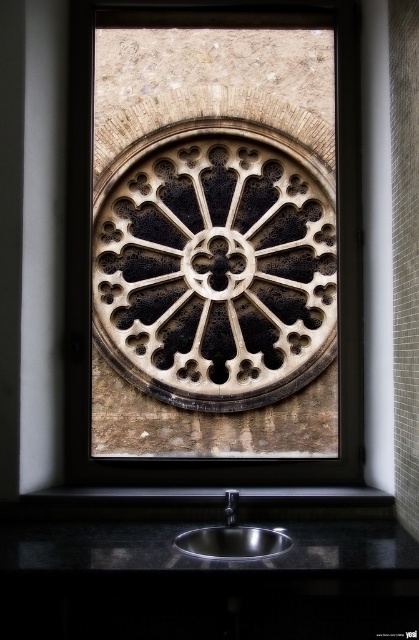
Question: Which of the following is the farthest from the observer?

Choices:
 (A) (227, 516)
 (B) (269, 554)
 (C) (284, 76)

Answer: (C)

Question: Among these objects, which one is nearest to the camera?

Choices:
 (A) black stone rose window at center
 (B) black metallic faucet at lower center

Answer: (B)

Question: Which is nearer to the black stone rose window at center?

Choices:
 (A) polished stainless steel sink at lower center
 (B) black metallic faucet at lower center

Answer: (A)

Question: Is black stone rose window at center below black metallic faucet at lower center?

Choices:
 (A) yes
 (B) no

Answer: (B)

Question: Can you confirm if polished stainless steel sink at lower center is positioned below black metallic faucet at lower center?

Choices:
 (A) yes
 (B) no

Answer: (A)

Question: Does black stone rose window at center appear on the left side of polished stainless steel sink at lower center?

Choices:
 (A) no
 (B) yes

Answer: (A)